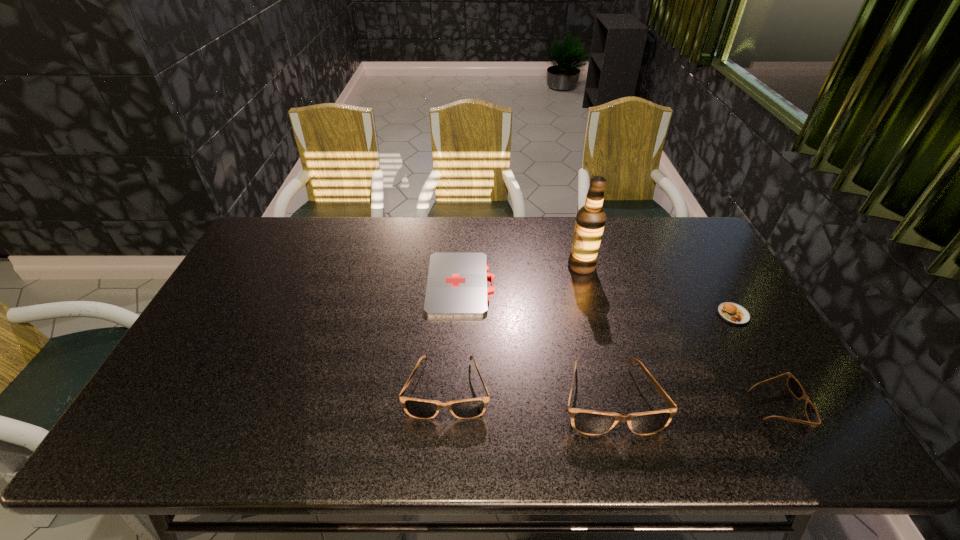
This screenshot has height=540, width=960. In order to click on free point that satisfies the following two spatial constraints: 1. on the label of the alcohol; 2. on the frames of the second sunglasses from left to right in this screenshot , I will do `click(616, 397)`.